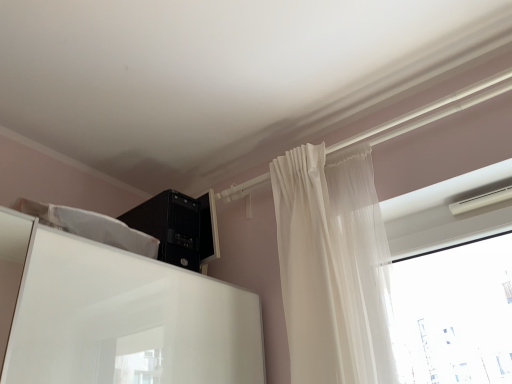
What is the approximate height of sheer white curtain at upper right?

sheer white curtain at upper right is 91.56 centimeters in height.

Describe the element at coordinates (333, 267) in the screenshot. Image resolution: width=512 pixels, height=384 pixels. I see `sheer white curtain at upper right` at that location.

Identify the location of sheer white curtain at upper right. The width and height of the screenshot is (512, 384). (333, 267).

From the picture: In order to face black plastic computer tower at upper center, should I rotate leftwards or rightwards?

Turn left approximately 13.495 degrees to face it.

At what (x,y) coordinates should I click in order to perform the action: click on black plastic computer tower at upper center. Please return your answer as a coordinate pair (x, y). The image size is (512, 384). Looking at the image, I should click on (170, 227).

Describe the element at coordinates (170, 227) in the screenshot. I see `black plastic computer tower at upper center` at that location.

Identify the location of sheer white curtain at upper right. (333, 267).

Visually, is sheer white curtain at upper right positioned to the left or to the right of black plastic computer tower at upper center?

Based on their positions, sheer white curtain at upper right is located to the right of black plastic computer tower at upper center.

Does sheer white curtain at upper right come in front of black plastic computer tower at upper center?

Yes, the depth of sheer white curtain at upper right is less than that of black plastic computer tower at upper center.

Does point (298, 326) come closer to viewer compared to point (126, 213)?

Yes, point (298, 326) is in front of point (126, 213).

From the image's perspective, is sheer white curtain at upper right beneath black plastic computer tower at upper center?

Correct, sheer white curtain at upper right appears lower than black plastic computer tower at upper center in the image.

From a real-world perspective, between sheer white curtain at upper right and black plastic computer tower at upper center, who is vertically lower?

sheer white curtain at upper right is physically lower.

Does sheer white curtain at upper right have a greater width compared to black plastic computer tower at upper center?

No, sheer white curtain at upper right is not wider than black plastic computer tower at upper center.

Between sheer white curtain at upper right and black plastic computer tower at upper center, which one has more height?

With more height is sheer white curtain at upper right.

Is sheer white curtain at upper right smaller than black plastic computer tower at upper center?

No, sheer white curtain at upper right is not smaller than black plastic computer tower at upper center.

Is black plastic computer tower at upper center located within sheer white curtain at upper right?

No, black plastic computer tower at upper center is not inside sheer white curtain at upper right.

Is sheer white curtain at upper right far from black plastic computer tower at upper center?

Actually, sheer white curtain at upper right and black plastic computer tower at upper center are a little close together.

Is sheer white curtain at upper right looking in the opposite direction of black plastic computer tower at upper center?

No, sheer white curtain at upper right is not facing away from black plastic computer tower at upper center.

How different are the orientations of sheer white curtain at upper right and black plastic computer tower at upper center in degrees?

sheer white curtain at upper right and black plastic computer tower at upper center are facing 91.7 degrees away from each other.

The image size is (512, 384). Identify the location of appliance on the left of sheer white curtain at upper right. point(170,227).

Considering the relative positions of black plastic computer tower at upper center and sheer white curtain at upper right in the image provided, is black plastic computer tower at upper center to the left of sheer white curtain at upper right from the viewer's perspective?

Correct, you'll find black plastic computer tower at upper center to the left of sheer white curtain at upper right.

Is black plastic computer tower at upper center further to camera compared to sheer white curtain at upper right?

Yes, black plastic computer tower at upper center is behind sheer white curtain at upper right.

Considering the positions of point (157, 204) and point (298, 201), is point (157, 204) closer or farther from the camera than point (298, 201)?

Clearly, point (157, 204) is more distant from the camera than point (298, 201).

From the image's perspective, is black plastic computer tower at upper center positioned above or below sheer white curtain at upper right?

black plastic computer tower at upper center is situated higher than sheer white curtain at upper right in the image.

From a real-world perspective, which object stands above the other?

black plastic computer tower at upper center, from a real-world perspective.

Looking at their sizes, would you say black plastic computer tower at upper center is wider or thinner than sheer white curtain at upper right?

Considering their sizes, black plastic computer tower at upper center looks broader than sheer white curtain at upper right.

Considering the sizes of objects black plastic computer tower at upper center and sheer white curtain at upper right in the image provided, who is taller, black plastic computer tower at upper center or sheer white curtain at upper right?

With more height is sheer white curtain at upper right.

Who is smaller, black plastic computer tower at upper center or sheer white curtain at upper right?

With smaller size is black plastic computer tower at upper center.

Would you say sheer white curtain at upper right is part of black plastic computer tower at upper center's contents?

No, sheer white curtain at upper right is not surrounded by black plastic computer tower at upper center.

Are black plastic computer tower at upper center and sheer white curtain at upper right far apart?

black plastic computer tower at upper center is actually quite close to sheer white curtain at upper right.

Is black plastic computer tower at upper center oriented away from sheer white curtain at upper right?

No, black plastic computer tower at upper center's orientation is not away from sheer white curtain at upper right.

Consider the image. Can you tell me how much black plastic computer tower at upper center and sheer white curtain at upper right differ in facing direction?

91.7 degrees.

Measure the distance from black plastic computer tower at upper center to sheer white curtain at upper right.

They are 22.20 inches apart.

There is a sheer white curtain at upper right. Where is `appliance above it (from a real-world perspective)`? This screenshot has width=512, height=384. appliance above it (from a real-world perspective) is located at coordinates (170, 227).

Image resolution: width=512 pixels, height=384 pixels. In order to click on curtain below the black plastic computer tower at upper center (from the image's perspective) in this screenshot , I will do `click(333, 267)`.

Locate an element on the screen. The image size is (512, 384). appliance behind the sheer white curtain at upper right is located at coordinates (170, 227).